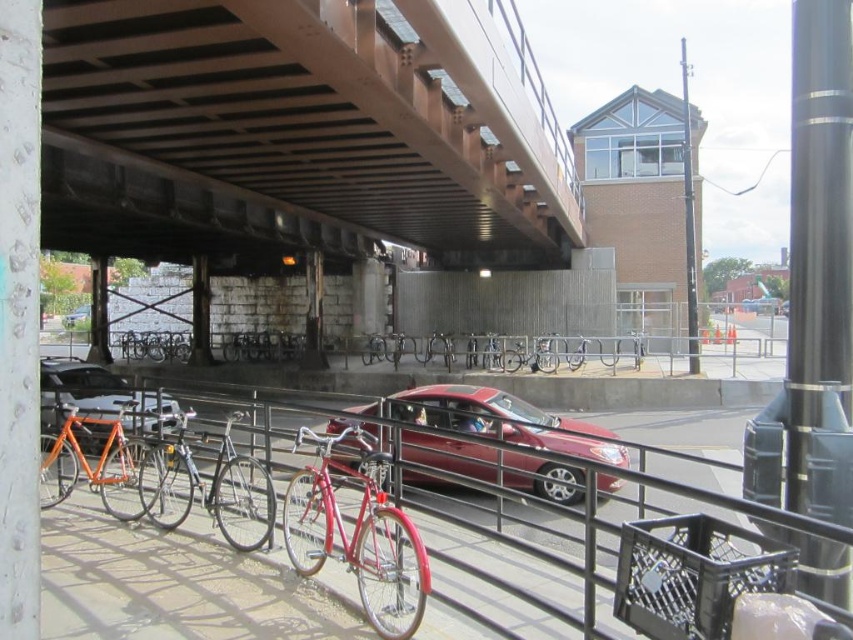
You are a delivery person needing to park your shiny silver bicycle at center near the metallic silver sedan at center. Can you park the bicycle directly under the sedan without it getting hit by the overpass above?

The shiny silver bicycle at center is already located below the metallic silver sedan at center, so parking it there would place it directly under the sedan. However, the overpass structure with its steel framework is above this area, so the bicycle might be protected from direct hits by the overpass. But since the sedan is above, ensure there is enough clearance to avoid any overhang from the sedan.

You are a delivery person needing to load a tall package onto a cart. The package is 1.5 meters tall. You see the shiny silver bicycle at center and the metallic silver sedan at center. Which object can the package fit under without hitting its top?

The package can fit under the metallic silver sedan at center because the shiny silver bicycle at center is not as tall as the metallic silver sedan at center, meaning the sedan has a higher clearance.

You are a delivery person who needs to load a shiny red bicycle at center and a matte black car at center into a truck. The truck has a height limit of 1.8 meters. Which item might not fit based on their heights?

The shiny red bicycle at center is taller than the matte black car at center. Since the truck has a height limit of 1.8 meters, the shiny red bicycle at center might not fit if its height exceeds this limit.